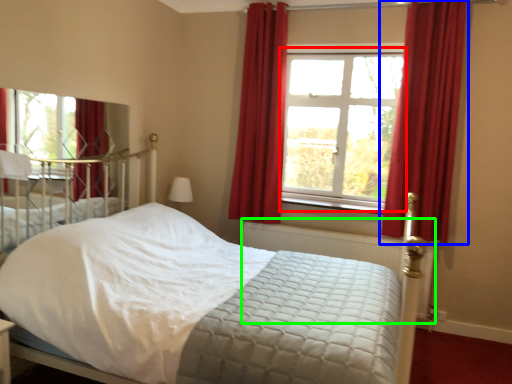
Question: Estimate the real-world distances between objects in this image. Which object is farther from window (highlighted by a red box), curtain (highlighted by a blue box) or balustrade (highlighted by a green box)?

Choices:
 (A) curtain
 (B) balustrade

Answer: (B)